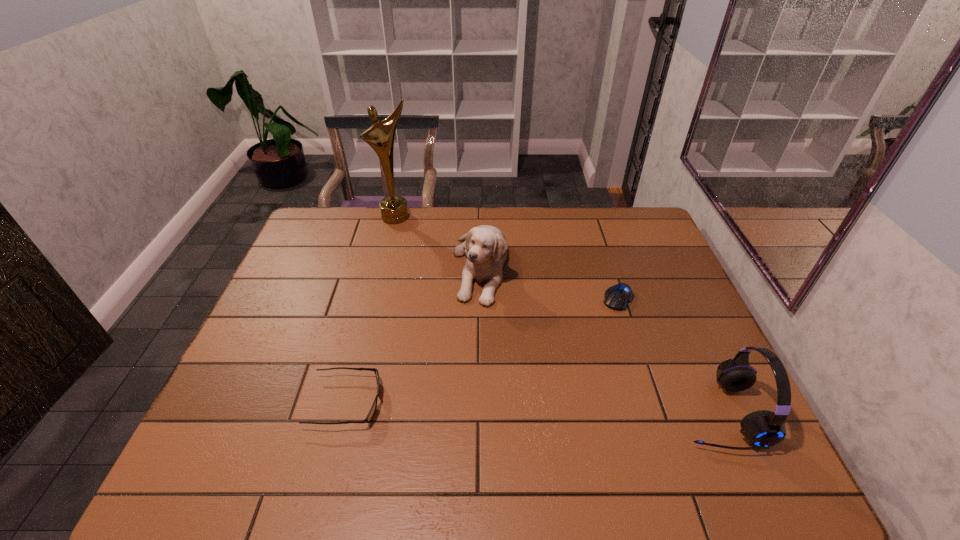
You are a GUI agent. You are given a task and a screenshot of the screen. Output one action in this format:
    pyautogui.click(x=<x>, y=<y>)
    Task: Click on the vacant space located 0.100m on the ear cushions of the headset
    The width and height of the screenshot is (960, 540).
    Given the screenshot: What is the action you would take?
    (x=635, y=413)

At what (x,y) coordinates should I click in order to perform the action: click on free space located on the front-facing side of the puppy. Please return your answer as a coordinate pair (x, y). Looking at the image, I should click on (481, 340).

Find the location of `vacant area located 0.330m on the front-facing side of the puppy`. vacant area located 0.330m on the front-facing side of the puppy is located at coordinates (482, 409).

In order to click on vacant area located 0.290m on the front-facing side of the puppy in this screenshot , I will do `click(482, 394)`.

Find the location of a particular element. free space located on the front-facing side of the tallest object is located at coordinates (437, 291).

Locate an element on the screen. This screenshot has width=960, height=540. vacant area situated on the front-facing side of the tallest object is located at coordinates (416, 249).

Where is `free space located on the front-facing side of the tallest object`? The width and height of the screenshot is (960, 540). free space located on the front-facing side of the tallest object is located at coordinates (408, 235).

The height and width of the screenshot is (540, 960). In order to click on vacant space located on the button side of the shortest object in this screenshot , I will do `click(594, 335)`.

Where is `free space located 0.340m on the button side of the shortest object`? The height and width of the screenshot is (540, 960). free space located 0.340m on the button side of the shortest object is located at coordinates (555, 391).

Identify the location of blank space located on the button side of the shortest object. (555, 391).